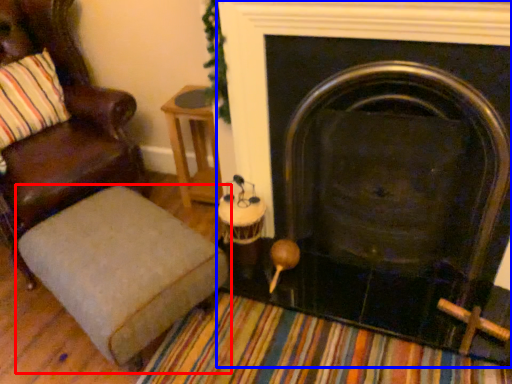
Question: Among these objects, which one is farthest to the camera, furniture (highlighted by a red box) or fireplace (highlighted by a blue box)?

Choices:
 (A) furniture
 (B) fireplace

Answer: (A)